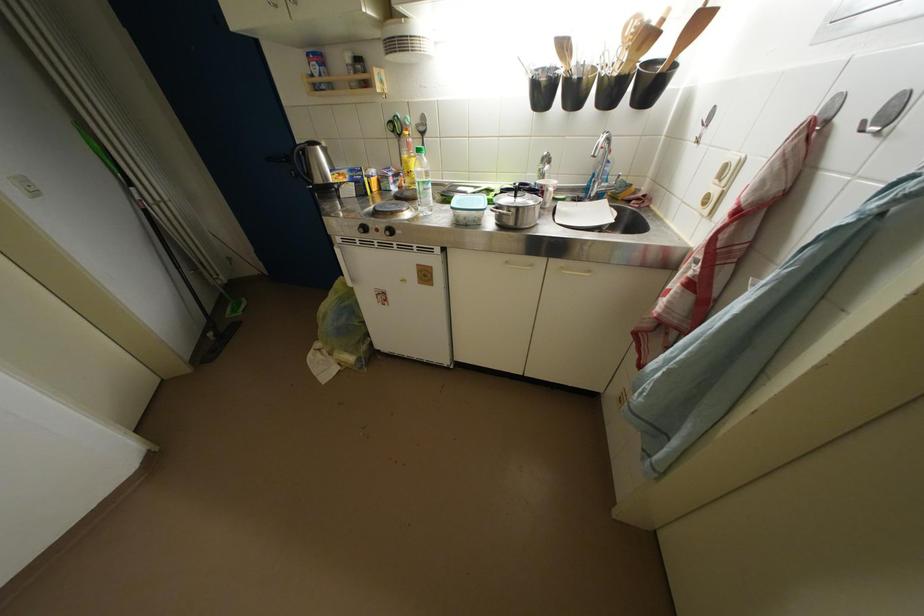
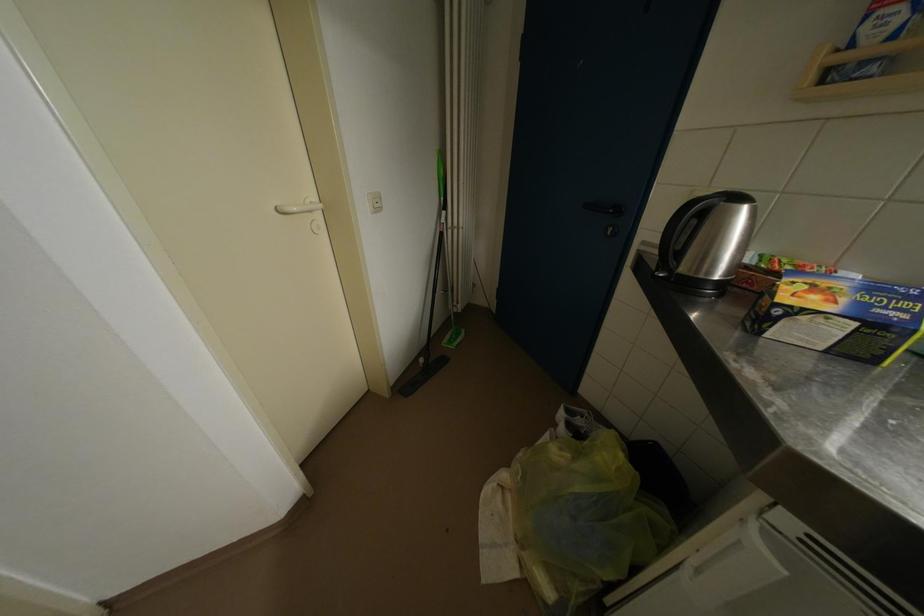
In the second image, find the point that corresponds to (x=324, y=349) in the first image.

(511, 480)